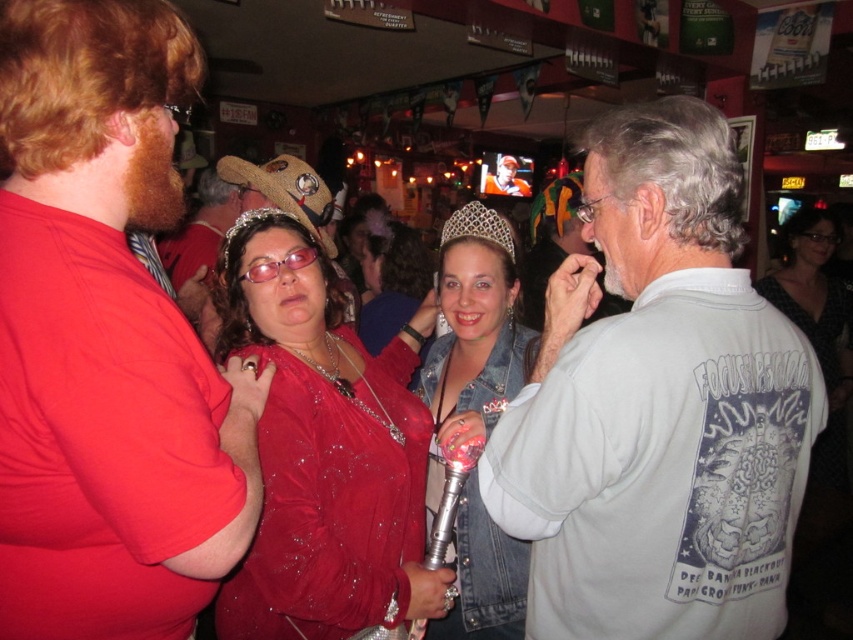
Question: Considering the relative positions of denim jacket at center and orange fabric shirt at center in the image provided, where is denim jacket at center located with respect to orange fabric shirt at center?

Choices:
 (A) left
 (B) right

Answer: (B)

Question: Estimate the real-world distances between objects in this image. Which object is farther from the shiny red dress at center?

Choices:
 (A) matte red shirt at left
 (B) white cotton shirt at right

Answer: (B)

Question: Among these points, which one is nearest to the camera?

Choices:
 (A) (831, 340)
 (B) (103, 36)
 (C) (480, 346)
 (D) (483, 168)

Answer: (B)

Question: Does matte red shirt at left come in front of white cotton shirt at right?

Choices:
 (A) no
 (B) yes

Answer: (B)

Question: Can you confirm if sparkly silver tiara at center is positioned above orange fabric shirt at center?

Choices:
 (A) yes
 (B) no

Answer: (B)

Question: Which of the following is the closest to the observer?

Choices:
 (A) (497, 168)
 (B) (628, 284)

Answer: (B)